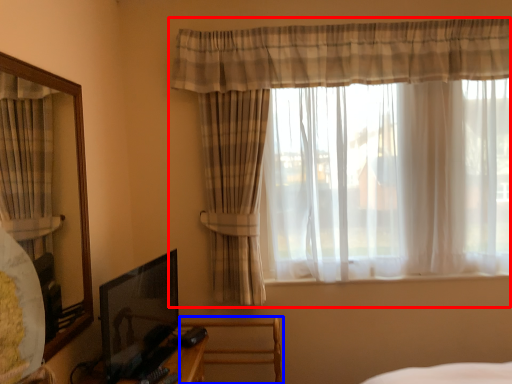
Question: Among these objects, which one is nearest to the camera, curtain (highlighted by a red box) or swivel chair (highlighted by a blue box)?

Choices:
 (A) curtain
 (B) swivel chair

Answer: (A)